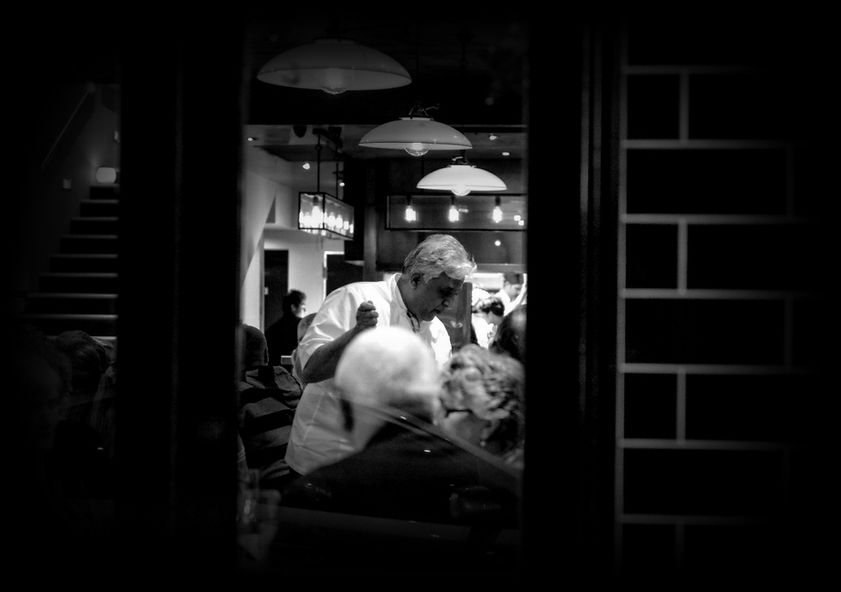
Identify the location of brick wall. (720, 347).